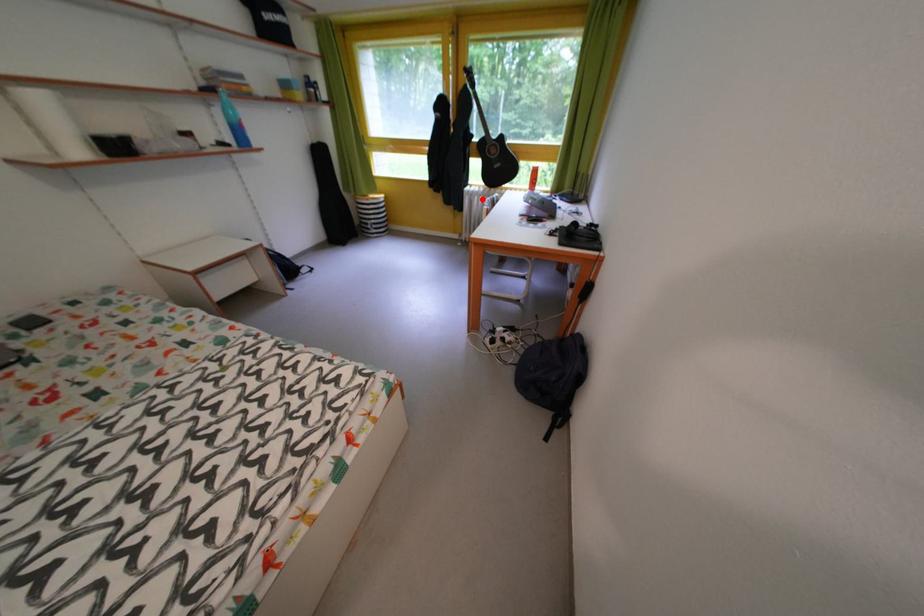
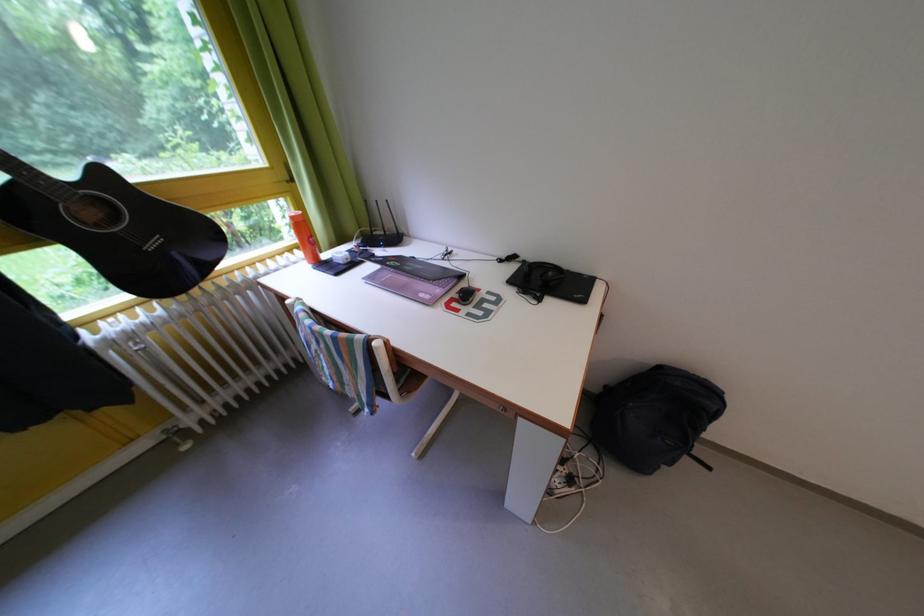
Question: I am providing you with two images of the same scene from different viewpoints. A red point is shown in image1. For the corresponding object point in image2, is it positioned nearer or farther from the camera?

Choices:
 (A) Nearer
 (B) Farther

Answer: (B)